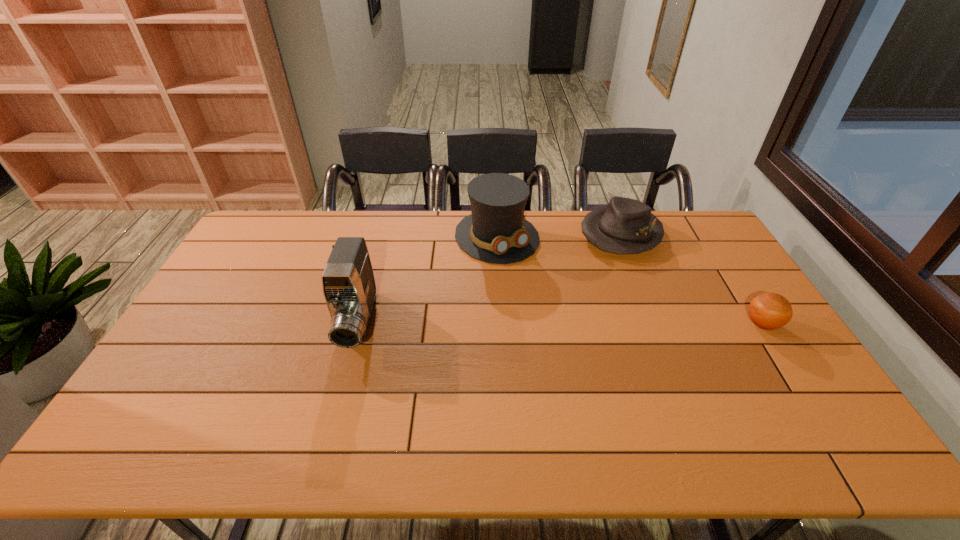
Identify the location of object that ranks as the second closest to the leftmost object. The image size is (960, 540). (625, 226).

Identify which object is the third closest to the third shortest object. Please provide its 2D coordinates. Your answer should be formatted as a tuple, i.e. [(x, y)], where the tuple contains the x and y coordinates of a point satisfying the conditions above.

[(769, 311)]

Find the location of a particular element. The height and width of the screenshot is (540, 960). vacant position in the image that satisfies the following two spatial constraints: 1. at the front of the leftmost object, highlighting the lens; 2. on the left side of the orange is located at coordinates (358, 323).

This screenshot has height=540, width=960. I want to click on vacant space that satisfies the following two spatial constraints: 1. at the front of the camcorder, highlighting the lens; 2. on the left side of the orange, so click(x=358, y=323).